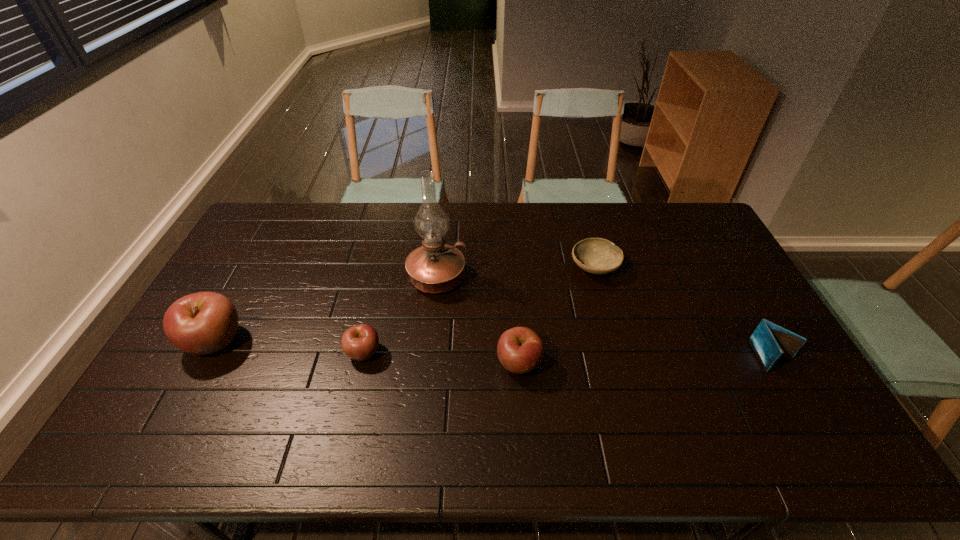
The height and width of the screenshot is (540, 960). In order to click on the second tallest object in this screenshot , I will do `click(201, 323)`.

Locate an element on the screen. the leftmost apple is located at coordinates (201, 323).

This screenshot has height=540, width=960. I want to click on the fifth object from right to left, so click(x=360, y=342).

Where is `the shortest apple`? the shortest apple is located at coordinates (360, 342).

Find the location of a particular element. The height and width of the screenshot is (540, 960). the fourth object from left to right is located at coordinates (520, 350).

Locate an element on the screen. This screenshot has width=960, height=540. the rightmost apple is located at coordinates (520, 350).

You are a GUI agent. You are given a task and a screenshot of the screen. Output one action in this format:
    pyautogui.click(x=<x>, y=<y>)
    Task: Click on the bowl
    This screenshot has height=540, width=960.
    Given the screenshot: What is the action you would take?
    pyautogui.click(x=598, y=256)

This screenshot has height=540, width=960. Identify the location of the shortest object. [x=598, y=256].

Identify the location of oil lamp. This screenshot has height=540, width=960. (435, 267).

I want to click on the third object from left to right, so click(x=435, y=267).